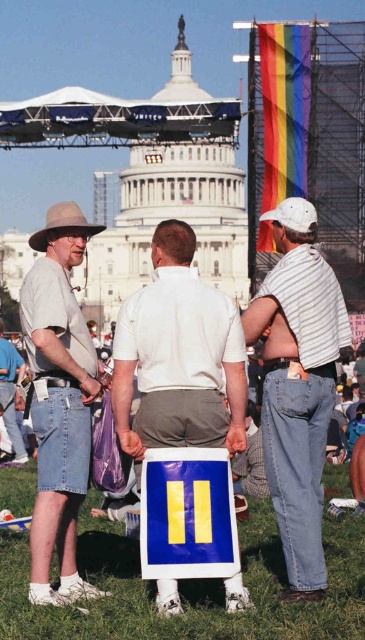
Is green grass at lower center smaller than white matte sign at center?

No.

Can you confirm if green grass at lower center is wider than white matte sign at center?

Yes, green grass at lower center is wider than white matte sign at center.

Is point (178, 628) closer to viewer compared to point (204, 372)?

Yes, point (178, 628) is in front of point (204, 372).

Identify the location of green grass at lower center. The height and width of the screenshot is (640, 365). (189, 588).

Can you confirm if green grass at lower center is positioned to the left of striped cotton shirt at center?

Correct, you'll find green grass at lower center to the left of striped cotton shirt at center.

Does green grass at lower center lie in front of striped cotton shirt at center?

Yes, green grass at lower center is in front of striped cotton shirt at center.

Which is behind, point (100, 580) or point (287, 336)?

Point (287, 336)

Identify the location of green grass at lower center. (189, 588).

What do you see at coordinates (189, 588) in the screenshot? I see `green grass at lower center` at bounding box center [189, 588].

Who is lower down, green grass at lower center or brown felt cowboy hat at left?

green grass at lower center is lower down.

The height and width of the screenshot is (640, 365). What do you see at coordinates (189, 588) in the screenshot?
I see `green grass at lower center` at bounding box center [189, 588].

Where is `green grass at lower center`? green grass at lower center is located at coordinates (189, 588).